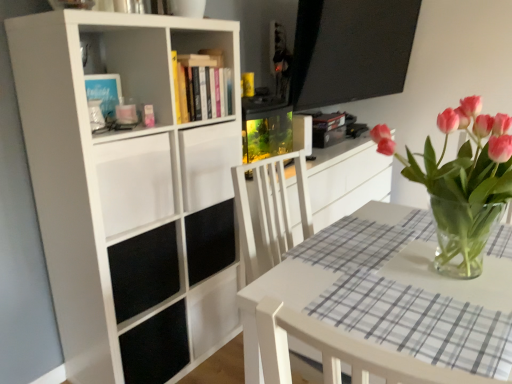
Identify the location of vacant space underneath pink glass vase at center (from a real-world perspective). (435, 271).